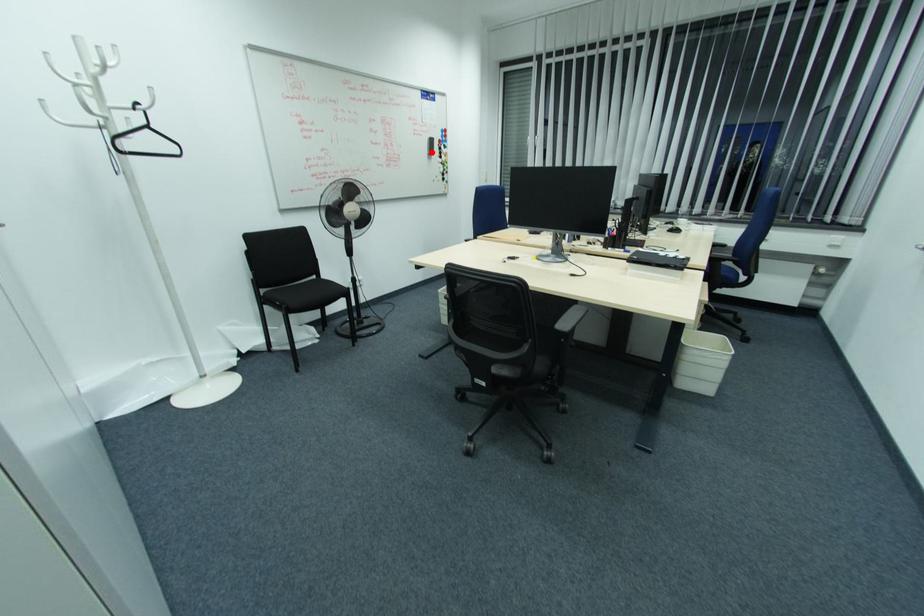
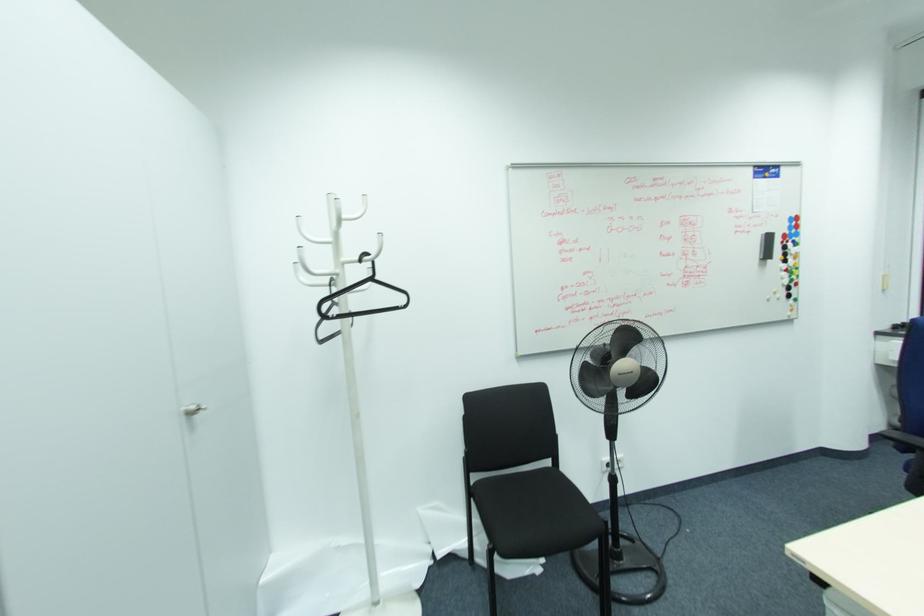
Question: I am providing you with two images of the same scene from different viewpoints. Image1 has a red point marked. In image2, the corresponding 3D location appears at what relative position? Reply with the corresponding letter.

Choices:
 (A) Closer
 (B) Farther

Answer: (B)